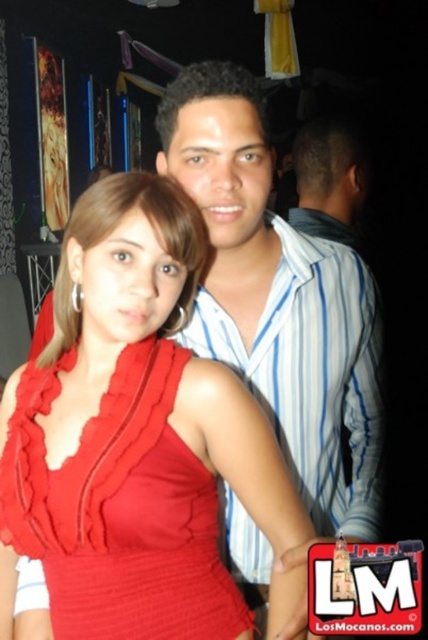
Question: Is red satin dress at center smaller than striped cotton shirt at upper center?

Choices:
 (A) yes
 (B) no

Answer: (A)

Question: Is red satin dress at center positioned in front of striped cotton shirt at upper center?

Choices:
 (A) yes
 (B) no

Answer: (A)

Question: Which object is the farthest from the striped cotton shirt at upper center?

Choices:
 (A) matte blue shirt at center
 (B) red satin dress at center

Answer: (A)

Question: Which is nearer to the striped cotton shirt at upper center?

Choices:
 (A) red satin dress at center
 (B) matte blue shirt at center

Answer: (A)

Question: Is red satin dress at center behind striped cotton shirt at upper center?

Choices:
 (A) no
 (B) yes

Answer: (A)

Question: Among these objects, which one is farthest from the camera?

Choices:
 (A) matte blue shirt at center
 (B) striped cotton shirt at upper center
 (C) red satin dress at center

Answer: (A)